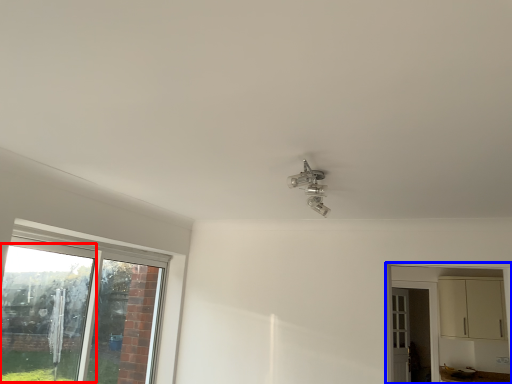
Question: Among these objects, which one is nearest to the camera, window screen (highlighted by a red box) or dresser (highlighted by a blue box)?

Choices:
 (A) window screen
 (B) dresser

Answer: (A)